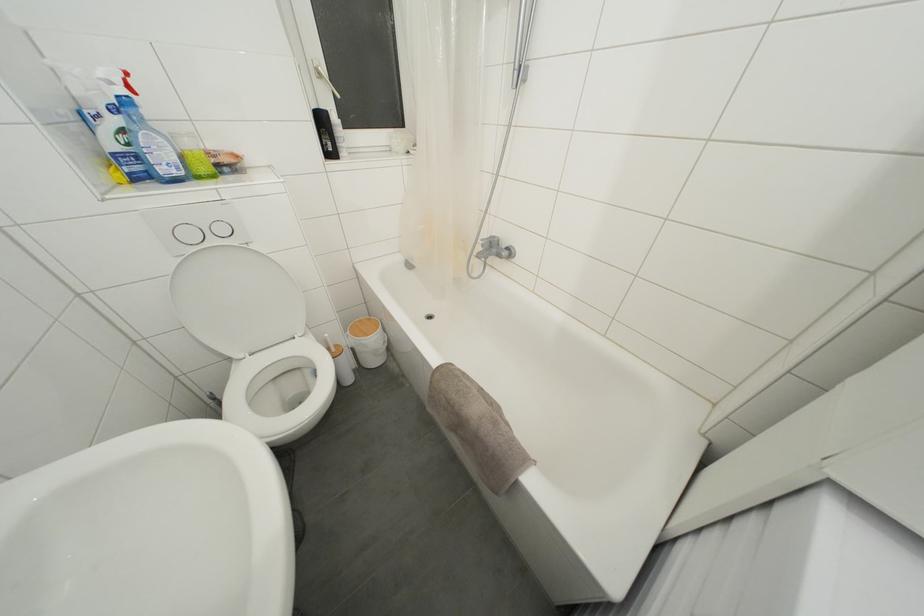
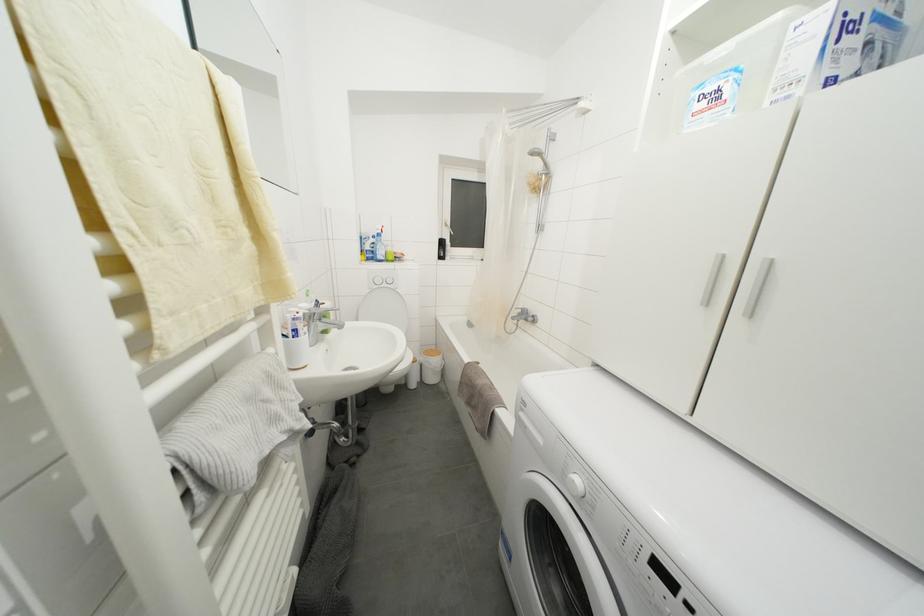
The images are taken continuously from a first-person perspective. In which direction are you moving?

The cameraman walked toward right, backward.